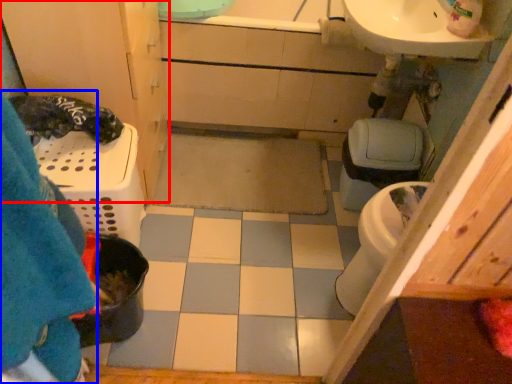
Question: Which object is closer to the camera taking this photo, bathroom cabinet (highlighted by a red box) or blanket (highlighted by a blue box)?

Choices:
 (A) bathroom cabinet
 (B) blanket

Answer: (B)